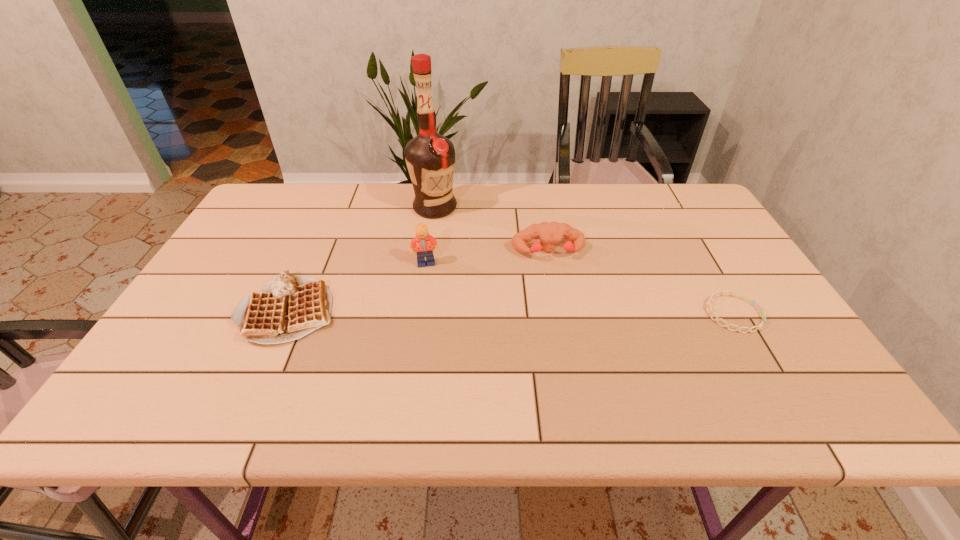
Find the location of a particular element. empty location between the third shortest object and the tallest object is located at coordinates (492, 230).

Image resolution: width=960 pixels, height=540 pixels. In order to click on vacant point located between the fourth shortest object and the second shortest object in this screenshot , I will do `click(357, 287)`.

The width and height of the screenshot is (960, 540). I want to click on free space between the waffle and the shortest object, so click(511, 312).

This screenshot has height=540, width=960. What are the coordinates of `unoccupied area between the third shortest object and the bracelet` in the screenshot? It's located at (641, 283).

Identify the location of vacant region between the second object from right to left and the liquor. (492, 230).

The height and width of the screenshot is (540, 960). I want to click on vacant space that is in between the waffle and the Lego, so click(x=357, y=287).

This screenshot has width=960, height=540. Identify the location of free space between the waffle and the second object from right to left. (419, 281).

In order to click on free space between the shortest object and the waffle in this screenshot , I will do [x=511, y=312].

At what (x,y) coordinates should I click in order to perform the action: click on blank region between the rightmost object and the tallest object. Please return your answer as a coordinate pair (x, y). This screenshot has height=540, width=960. Looking at the image, I should click on (584, 261).

Choose which object is the nearest neighbor to the bracelet. Please provide its 2D coordinates. Your answer should be formatted as a tuple, i.e. [(x, y)], where the tuple contains the x and y coordinates of a point satisfying the conditions above.

[(549, 234)]